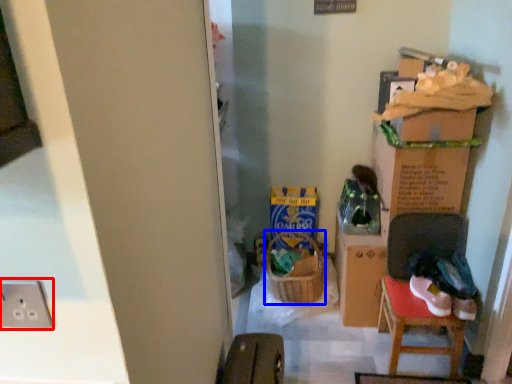
Question: Which object appears farthest to the camera in this image, electric outlet (highlighted by a red box) or laundry basket (highlighted by a blue box)?

Choices:
 (A) electric outlet
 (B) laundry basket

Answer: (B)